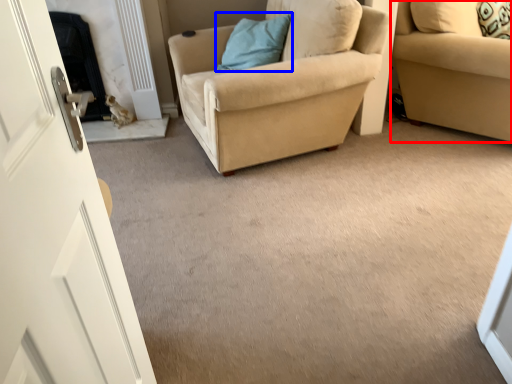
Question: Which object is closer to the camera taking this photo, studio couch (highlighted by a red box) or pillow (highlighted by a blue box)?

Choices:
 (A) studio couch
 (B) pillow

Answer: (A)